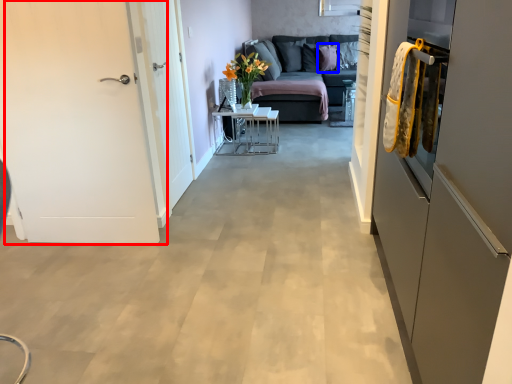
Question: Which of the following is the closest to the observer, door (highlighted by a red box) or pillow (highlighted by a blue box)?

Choices:
 (A) door
 (B) pillow

Answer: (A)